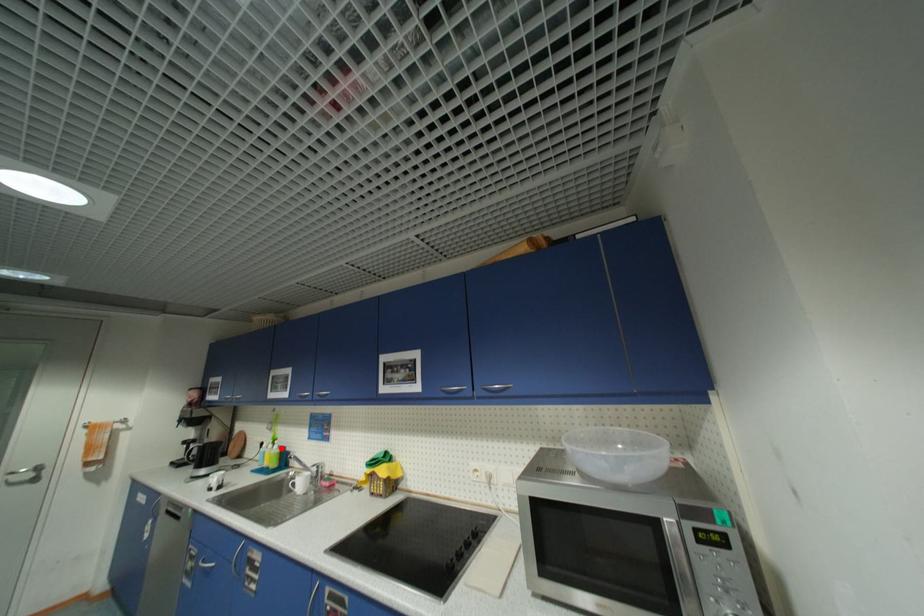
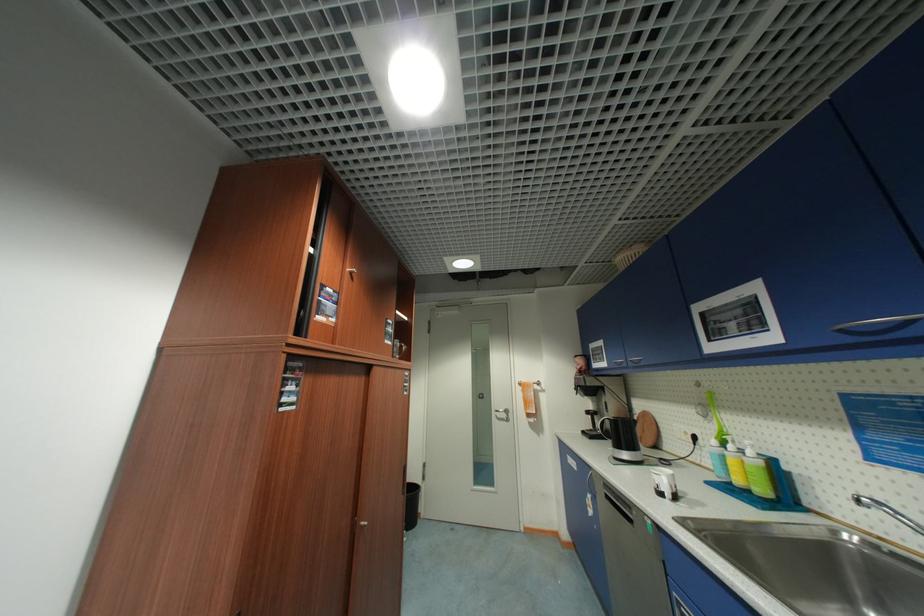
Question: I am providing you with two images of the same scene from different viewpoints. A red point is shown in image1. For the corresponding object point in image2, is it positioned nearer or farther from the camera?

Choices:
 (A) Nearer
 (B) Farther

Answer: (A)